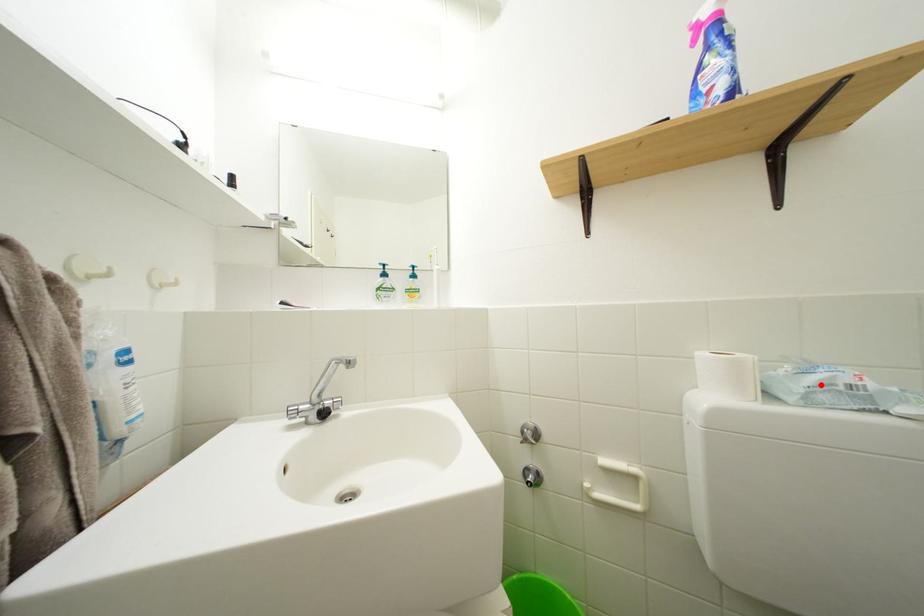
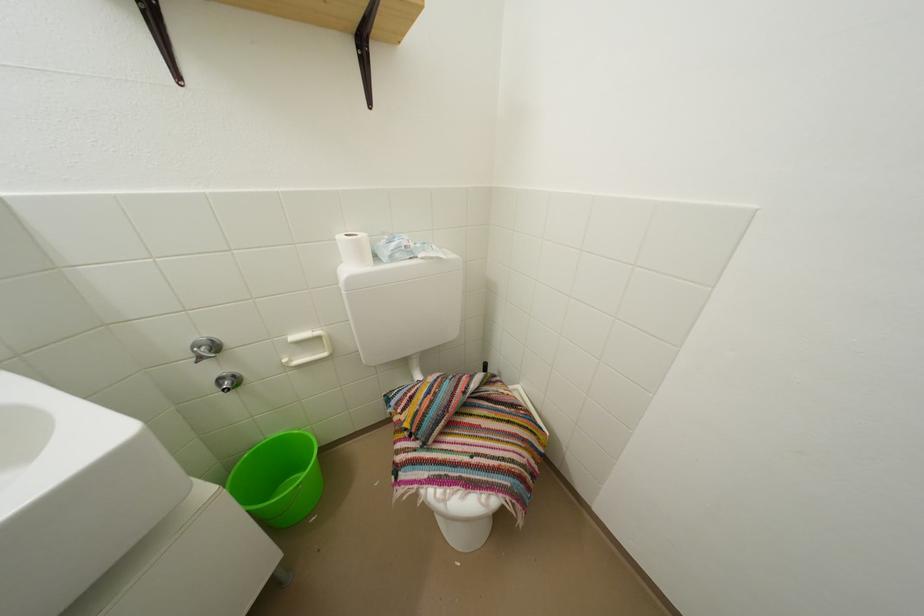
Find the pixel in the second image that matches the highlighted location in the first image.

(402, 251)